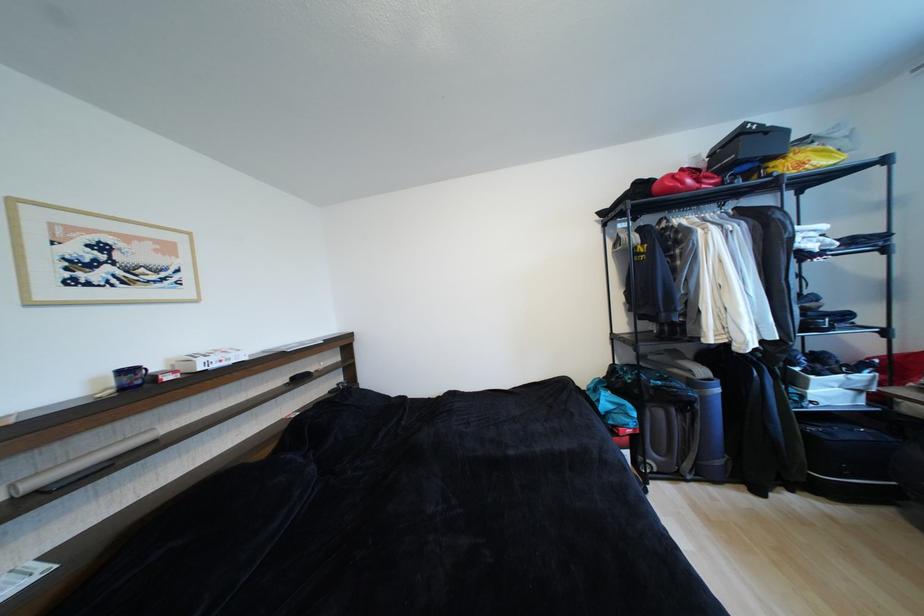
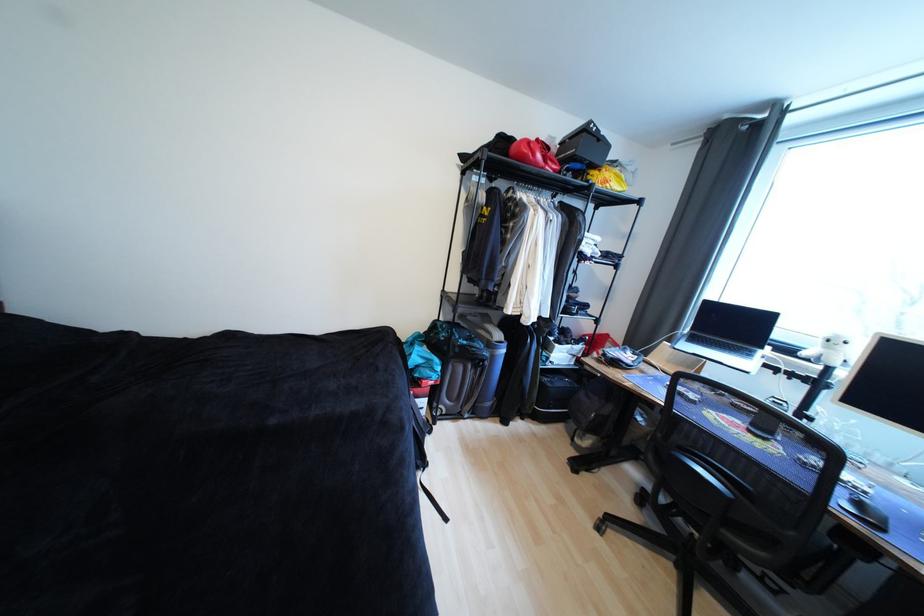
Where in the second image is the point corresponding to (664,389) from the first image?

(469, 347)